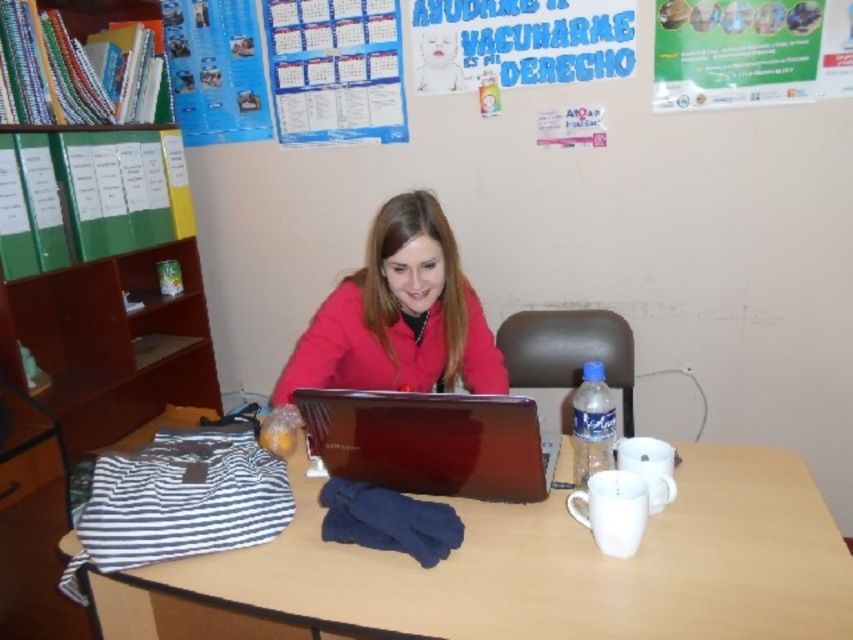
Question: Which of the following is the closest to the observer?

Choices:
 (A) green file folders at left
 (B) matte red jacket at center

Answer: (B)

Question: Does wooden table at center appear on the left side of matte paper calendar at upper center?

Choices:
 (A) no
 (B) yes

Answer: (A)

Question: Is green file folders at left positioned before matte paper calendar at upper center?

Choices:
 (A) yes
 (B) no

Answer: (A)

Question: Can you confirm if wooden table at center is smaller than matte paper calendar at upper center?

Choices:
 (A) yes
 (B) no

Answer: (B)

Question: Which point is closer to the camera?

Choices:
 (A) matte red jacket at center
 (B) glossy plastic laptop at center
 (C) green file folders at left
 (D) matte paper calendar at upper center

Answer: (B)

Question: Which point appears closest to the camera in this image?

Choices:
 (A) (337, 577)
 (B) (302, 92)

Answer: (A)